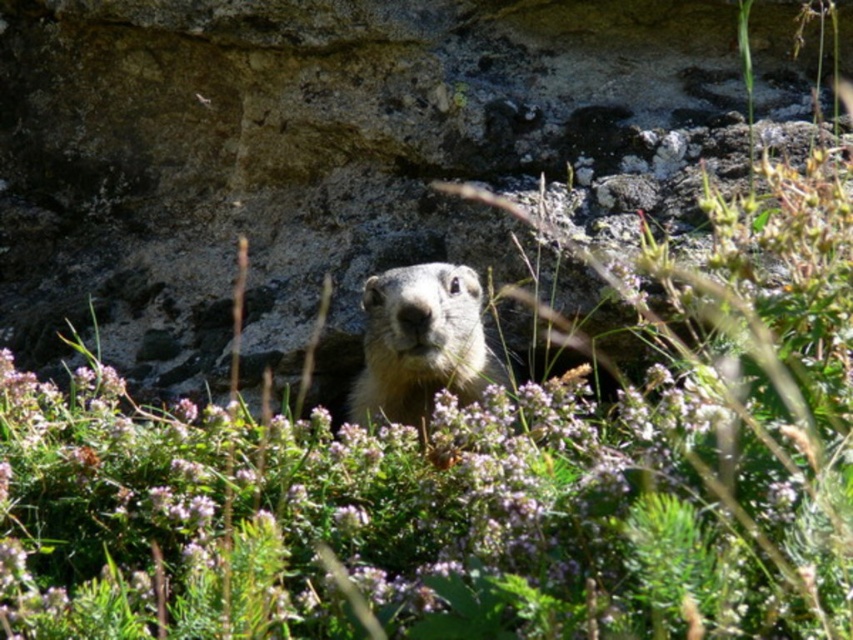
You are a photographer aiming to capture a clear shot of the gray rock at center. Your camera is currently positioned 1.99 meters away from the rock. If your camera has a minimum focusing distance of 2 meters, will you need to move closer or farther away to get a sharp image?

The gray rock at center is 1.99 meters away from the camera, which is just below the 2 meter minimum focusing distance. To achieve a sharp image, you need to move slightly farther away from the gray rock at center so that the distance exceeds 2 meters.

You are standing at the point marked as point [238,208] in the image of a groundhog near rocks. If you want to move closer to the groundhog, which direction should you go?

Since point [238,208] is 2.30 meters away from the viewer, moving towards the groundhog would require moving forward towards the image plane.

You are a photographer trying to capture the furry brown ground squirrel at center. The gray rock at center is blocking part of your view. Can you move the rock to get a clearer shot?

The gray rock at center is located above the furry brown ground squirrel at center, so moving the rock would allow you to see the squirrel more clearly.